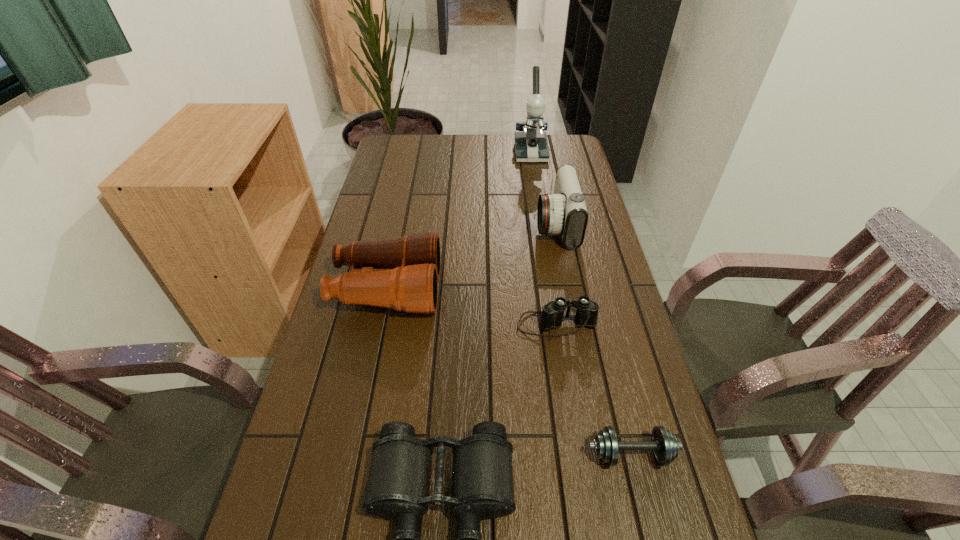
Locate which object is the second closest to the tallest object. Please provide its 2D coordinates. Your answer should be formatted as a tuple, i.e. [(x, y)], where the tuple contains the x and y coordinates of a point satisfying the conditions above.

[(401, 273)]

The height and width of the screenshot is (540, 960). What are the coordinates of `object that is the closest to the nearest binoculars` in the screenshot? It's located at (664, 444).

Find the location of a particular element. the second closest binoculars to the farthest object is located at coordinates (552, 316).

You are a GUI agent. You are given a task and a screenshot of the screen. Output one action in this format:
    pyautogui.click(x=<x>, y=<y>)
    Task: Click on the third closest binoculars to the camcorder
    
    Given the screenshot: What is the action you would take?
    pyautogui.click(x=482, y=481)

You are a GUI agent. You are given a task and a screenshot of the screen. Output one action in this format:
    pyautogui.click(x=<x>, y=<y>)
    Task: Click on the free space that satisfies the following two spatial constraints: 1. through the lenses of the fourth shortest object; 2. on the back side of the rightmost binoculars
    
    Given the screenshot: What is the action you would take?
    pyautogui.click(x=380, y=325)

Where is `blank space that satisfies the following two spatial constraints: 1. on the front side of the shortest object; 2. on the left side of the tallest object`? This screenshot has width=960, height=540. blank space that satisfies the following two spatial constraints: 1. on the front side of the shortest object; 2. on the left side of the tallest object is located at coordinates (578, 454).

Where is `free spot that satisfies the following two spatial constraints: 1. on the surface of the camcorder; 2. on the front side of the rightmost binoculars`? This screenshot has width=960, height=540. free spot that satisfies the following two spatial constraints: 1. on the surface of the camcorder; 2. on the front side of the rightmost binoculars is located at coordinates (576, 325).